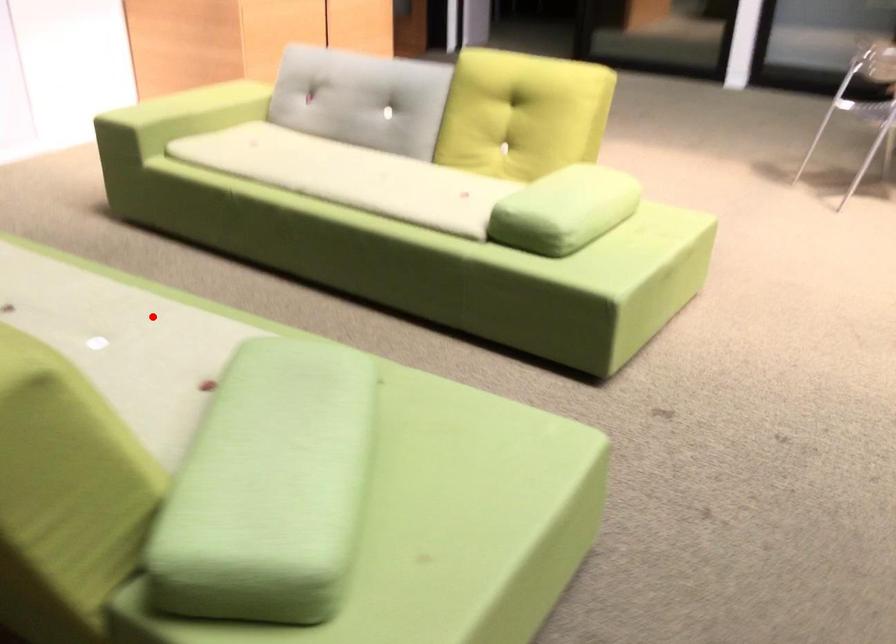
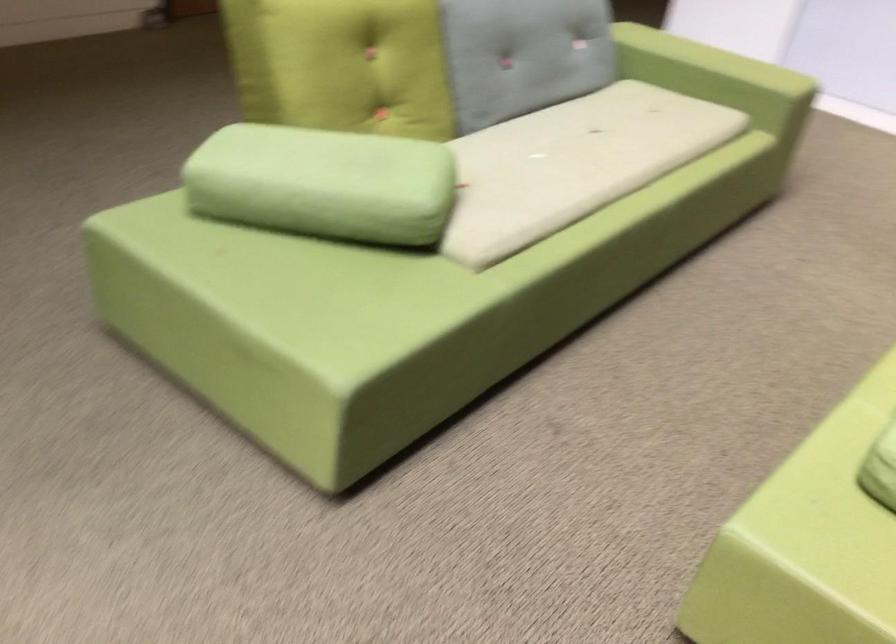
Find the pixel in the second image that matches the highlighted location in the first image.

(572, 164)